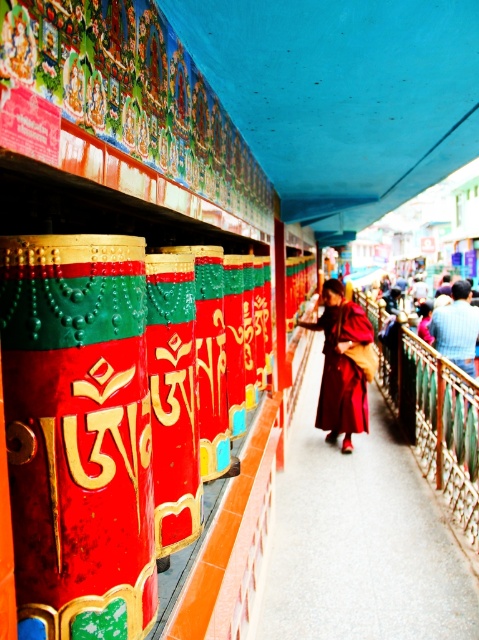
You are a photographer aiming to capture the scene with the maroon fabric robe at center and the dark blue woolen robe at center. Which robe should you focus on first if you want to photograph them from left to right?

You should focus on the maroon fabric robe at center first since it is positioned to the left of the dark blue woolen robe at center when viewed from left to right.

You are standing at the point with coordinates point (445, 307) and want to move towards the prayer wheels. Which direction should you go to reach the point (342, 289) that is closer to the prayer wheels?

Since point (342, 289) is in front of point (445, 307), you should move forward towards point (342, 289) to get closer to the prayer wheels.